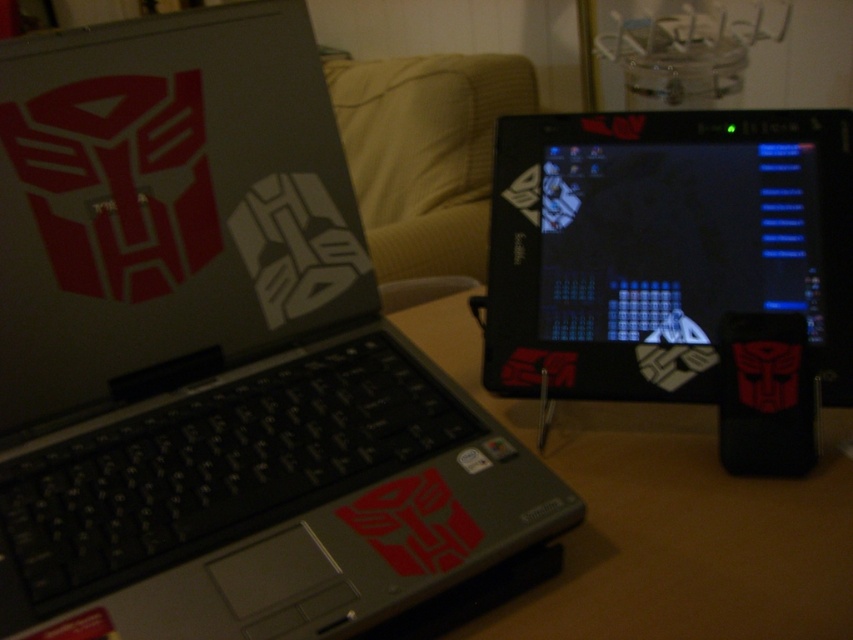
Question: Is matte black screen at center bigger than brown wooden table at center?

Choices:
 (A) no
 (B) yes

Answer: (A)

Question: Is matte black screen at center to the right of matte black laptop at center from the viewer's perspective?

Choices:
 (A) no
 (B) yes

Answer: (B)

Question: Which of the following is the farthest from the observer?

Choices:
 (A) (686, 424)
 (B) (468, 577)
 (C) (426, 212)

Answer: (C)

Question: Which object is the closest to the brown wooden table at center?

Choices:
 (A) matte black laptop at center
 (B) matte black screen at center
 (C) matte black laptop at left

Answer: (B)

Question: Among these points, which one is nearest to the camera?

Choices:
 (A) (x=252, y=525)
 (B) (x=808, y=630)
 (C) (x=445, y=227)
 (D) (x=756, y=147)

Answer: (B)

Question: Does matte black laptop at left appear on the right side of matte black screen at center?

Choices:
 (A) yes
 (B) no

Answer: (B)